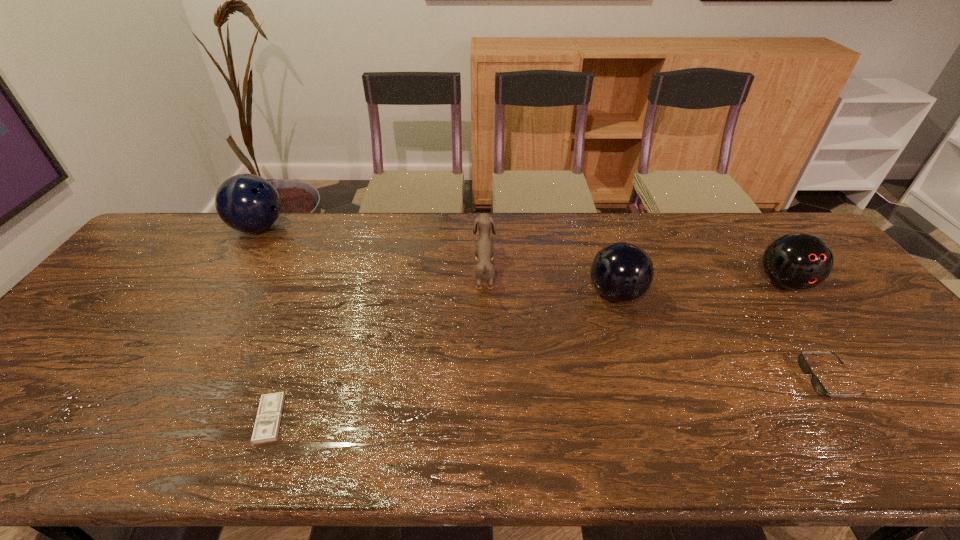
Image resolution: width=960 pixels, height=540 pixels. Find the location of `the farthest bowling ball`. the farthest bowling ball is located at coordinates (248, 203).

Locate an element on the screen. The image size is (960, 540). the leftmost bowling ball is located at coordinates (248, 203).

Where is `the second bowling ball from left to right`? This screenshot has width=960, height=540. the second bowling ball from left to right is located at coordinates (622, 272).

Identify the location of the rightmost bowling ball. This screenshot has height=540, width=960. (797, 261).

This screenshot has height=540, width=960. Identify the location of the third object from left to right. click(x=484, y=249).

Identify the location of sunglasses. (803, 364).

Where is `the fifth object from right to left`? This screenshot has height=540, width=960. the fifth object from right to left is located at coordinates (268, 418).

Image resolution: width=960 pixels, height=540 pixels. Find the location of `money`. money is located at coordinates (268, 418).

I want to click on free space located on the surface of the leftmost object near the finger holes, so click(325, 228).

Where is `vacant space located on the side of the second bowling ball from left to right with the finger holes`? The image size is (960, 540). vacant space located on the side of the second bowling ball from left to right with the finger holes is located at coordinates (538, 294).